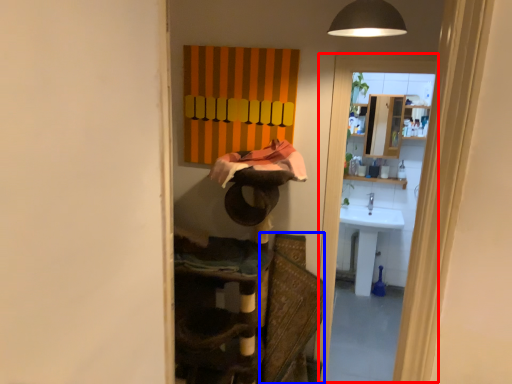
Question: Which object is closer to the camera taking this photo, screen door (highlighted by a red box) or swivel chair (highlighted by a blue box)?

Choices:
 (A) screen door
 (B) swivel chair

Answer: (B)